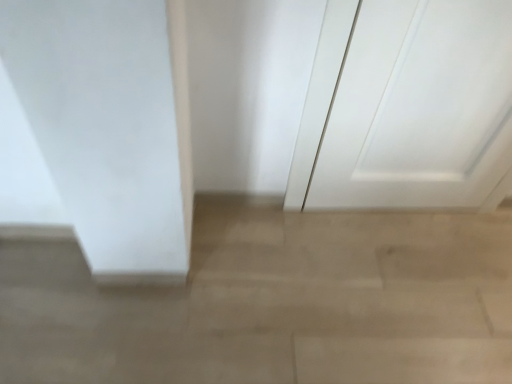
Question: Is beige polished concrete at center closer to the viewer compared to white matte door at upper right?

Choices:
 (A) no
 (B) yes

Answer: (A)

Question: From a real-world perspective, is beige polished concrete at center positioned under white matte door at upper right based on gravity?

Choices:
 (A) no
 (B) yes

Answer: (B)

Question: Is beige polished concrete at center directly adjacent to white matte door at upper right?

Choices:
 (A) yes
 (B) no

Answer: (B)

Question: Does beige polished concrete at center have a larger size compared to white matte door at upper right?

Choices:
 (A) yes
 (B) no

Answer: (A)

Question: Is beige polished concrete at center smaller than white matte door at upper right?

Choices:
 (A) no
 (B) yes

Answer: (A)

Question: Is the position of beige polished concrete at center more distant than that of white matte door at upper right?

Choices:
 (A) no
 (B) yes

Answer: (B)

Question: From a real-world perspective, is white matte door at upper right on beige polished concrete at center?

Choices:
 (A) no
 (B) yes

Answer: (B)

Question: Does white matte door at upper right turn towards beige polished concrete at center?

Choices:
 (A) no
 (B) yes

Answer: (A)

Question: Is white matte door at upper right next to beige polished concrete at center?

Choices:
 (A) yes
 (B) no

Answer: (B)

Question: From a real-world perspective, is white matte door at upper right located beneath beige polished concrete at center?

Choices:
 (A) yes
 (B) no

Answer: (B)

Question: Is white matte door at upper right further to camera compared to beige polished concrete at center?

Choices:
 (A) yes
 (B) no

Answer: (B)

Question: Is white matte door at upper right oriented away from beige polished concrete at center?

Choices:
 (A) yes
 (B) no

Answer: (B)

Question: Looking at the image, does white matte door at upper right seem bigger or smaller compared to beige polished concrete at center?

Choices:
 (A) big
 (B) small

Answer: (B)